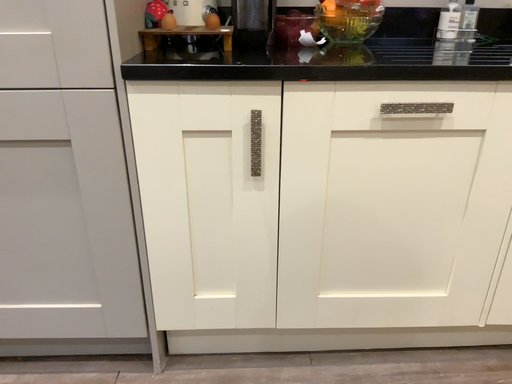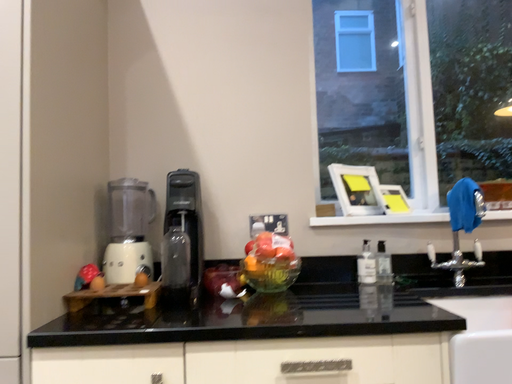
Question: How did the camera likely rotate when shooting the video?

Choices:
 (A) rotated upward
 (B) rotated downward

Answer: (A)